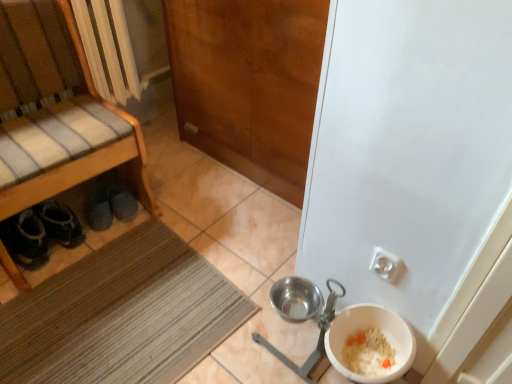
I want to click on vacant space in front of dark gray fabric shoes at lower left, so click(x=95, y=249).